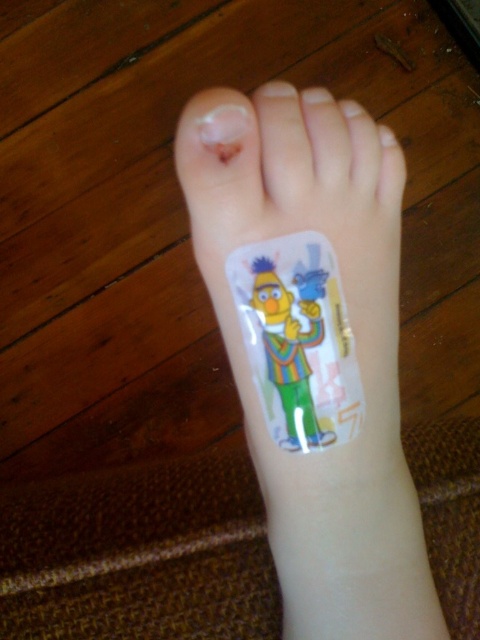
You are a physical therapist analyzing the positioning of two points on a patient. The first point is at coordinate point (403, 598) and the second is at point (226, 124). Based on the scene description, which point is closer to the viewer?

Point (226, 124) is closer to the viewer because the description states that point (403, 598) is behind point (226, 124).

You are a nurse assessing a patient with a cut on their big toe. The patient is sitting on a chair, and you need to disinfect the wound. The disinfectant spray is located at point (304, 621). Can you reach the disinfectant spray from your current position without moving your feet?

The distance between point (304, 621) and the viewer is 14.16 inches. Since the average arm length is about 25 inches, you can easily reach the disinfectant spray at point (304, 621) without moving your feet.

You are a medical professional assessing the foot injury. The bandage at lower center is crucial for protecting the cut on the big toe. Based on the coordinates given, is the transparent adhesive bandage at lower center placed correctly to cover the cut on the big toe?

The transparent adhesive bandage at lower center is placed at coordinates point (356, 355). Since the cut is on the big toe, which is located at a different position than the bandage, the bandage is not correctly placed to cover the cut on the big toe.